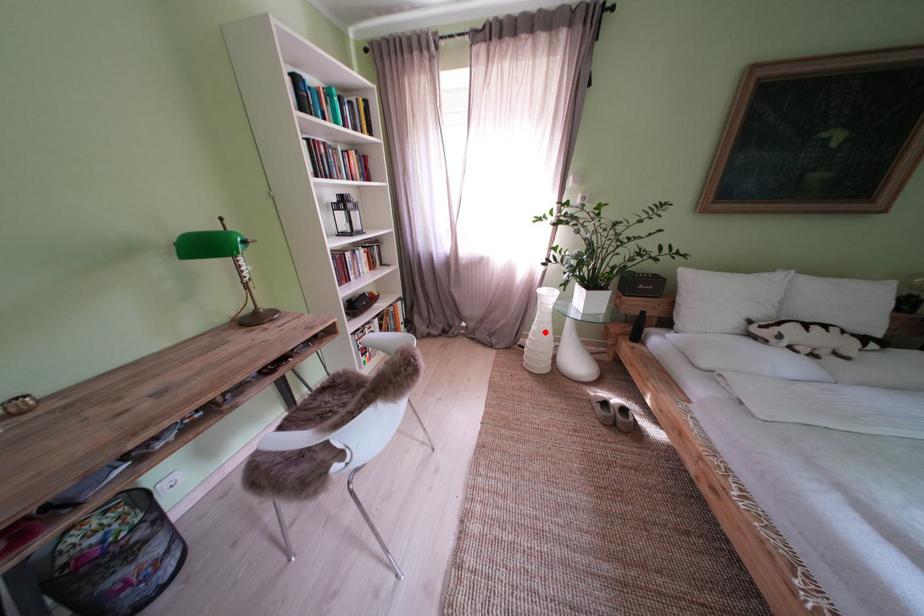
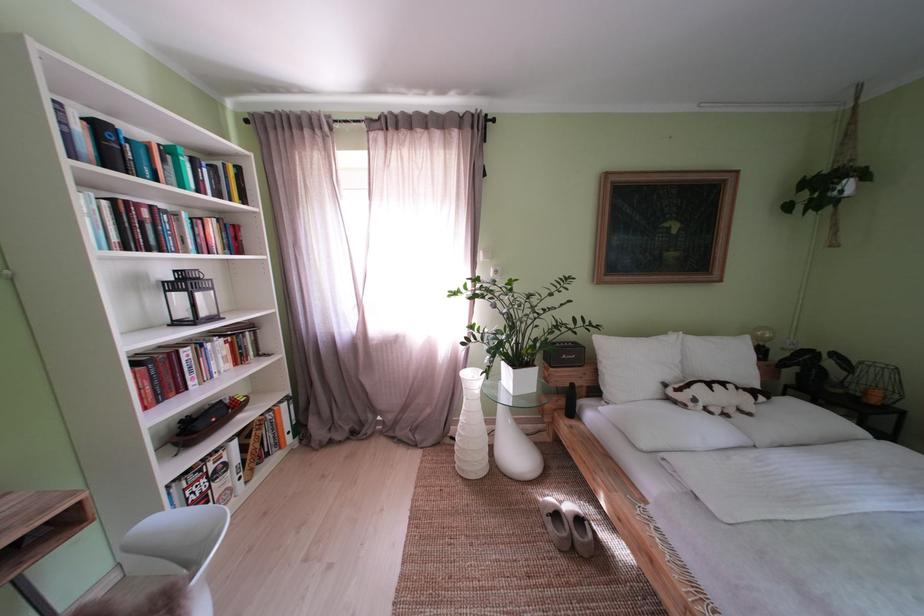
Question: A red point is marked in image1. In image2, is the corresponding 3D point closer to the camera or farther? Reply with the corresponding letter.

Choices:
 (A) The corresponding 3D point is closer.
 (B) The corresponding 3D point is farther.

Answer: (B)